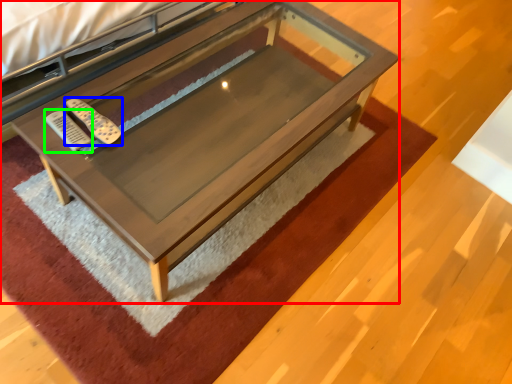
Question: Estimate the real-world distances between objects in this image. Which object is closer to table (highlighted by a red box), remote (highlighted by a blue box) or remote (highlighted by a green box)?

Choices:
 (A) remote
 (B) remote

Answer: (A)